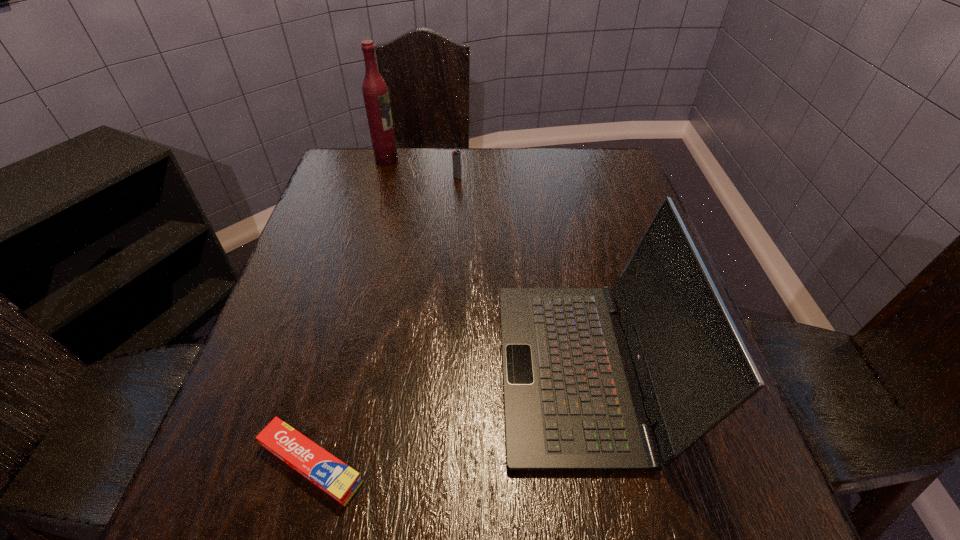
Locate which object ranks second in proximity to the rightmost object. Please provide its 2D coordinates. Your answer should be formatted as a tuple, i.e. [(x, y)], where the tuple contains the x and y coordinates of a point satisfying the conditions above.

[(456, 158)]

Image resolution: width=960 pixels, height=540 pixels. In order to click on vacant space that satisfies the following two spatial constraints: 1. on the screen of the rightmost object; 2. on the front side of the shortest object in this screenshot , I will do `click(598, 463)`.

Locate an element on the screen. Image resolution: width=960 pixels, height=540 pixels. free spot that satisfies the following two spatial constraints: 1. on the screen of the second tallest object; 2. on the front side of the toothpaste is located at coordinates (598, 463).

You are a GUI agent. You are given a task and a screenshot of the screen. Output one action in this format:
    pyautogui.click(x=<x>, y=<y>)
    Task: Click on the vacant area in the image that satisfies the following two spatial constraints: 1. on the back side of the igniter; 2. on the label of the liquor
    The width and height of the screenshot is (960, 540).
    Given the screenshot: What is the action you would take?
    pyautogui.click(x=458, y=160)

I want to click on vacant area in the image that satisfies the following two spatial constraints: 1. on the screen of the laptop computer; 2. on the front side of the toothpaste, so click(598, 463).